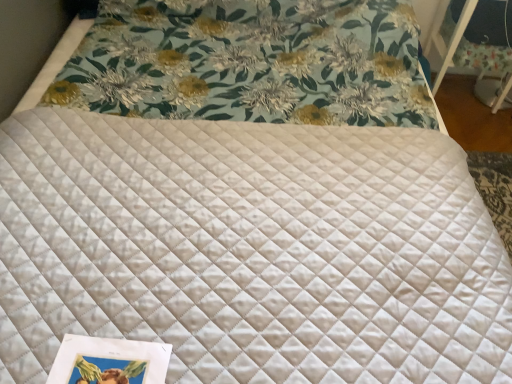
The image size is (512, 384). I want to click on white quilted table at upper right, so click(451, 37).

In order to face white quilted table at upper right, should I rotate leftwards or rightwards?

Turn right by 27.716 degrees to look at white quilted table at upper right.

Describe the element at coordinates (451, 37) in the screenshot. I see `white quilted table at upper right` at that location.

This screenshot has height=384, width=512. In order to click on white quilted table at upper right in this screenshot , I will do `click(451, 37)`.